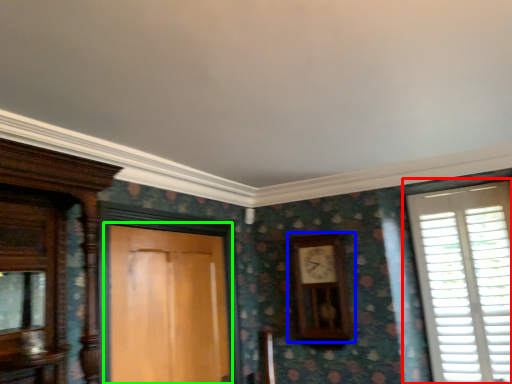
Question: Considering the real-world distances, which object is closest to window (highlighted by a red box)? clock (highlighted by a blue box) or door (highlighted by a green box).

Choices:
 (A) clock
 (B) door

Answer: (A)